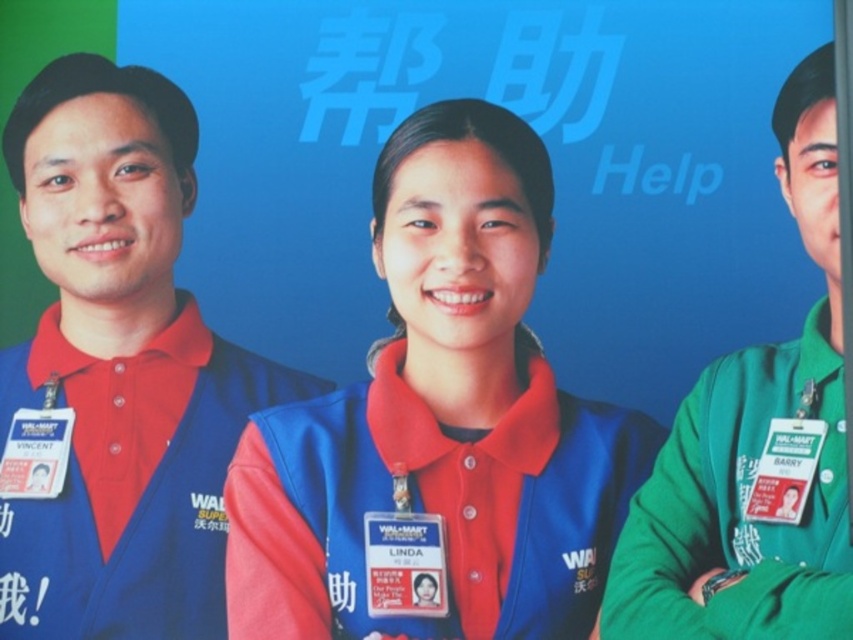
Question: Which of these objects is positioned farthest from the green fabric shirt at right?

Choices:
 (A) white plastic badge at left
 (B) matte plastic badge at center

Answer: (A)

Question: Does white plastic badge at right have a smaller size compared to white plastic badge at left?

Choices:
 (A) yes
 (B) no

Answer: (B)

Question: Is matte plastic badge at center to the left of white plastic badge at right from the viewer's perspective?

Choices:
 (A) no
 (B) yes

Answer: (B)

Question: Which object appears farthest from the camera in this image?

Choices:
 (A) matte plastic badge at center
 (B) blue fabric vest at center

Answer: (A)

Question: Does matte blue vest at left appear on the right side of matte plastic badge at center?

Choices:
 (A) no
 (B) yes

Answer: (A)

Question: Considering the real-world distances, which object is closest to the green fabric shirt at right?

Choices:
 (A) white plastic badge at right
 (B) matte blue vest at left
 (C) blue fabric vest at center
 (D) matte plastic badge at center

Answer: (A)